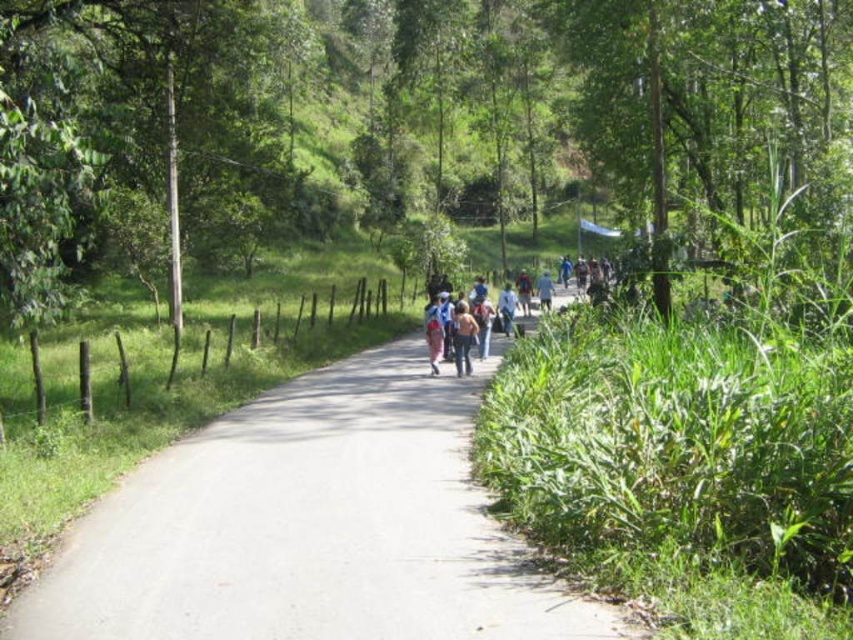
Does gray asphalt road at center have a lesser width compared to matte blue backpack at center?

In fact, gray asphalt road at center might be wider than matte blue backpack at center.

The width and height of the screenshot is (853, 640). I want to click on gray asphalt road at center, so click(x=311, y=525).

Is point (350, 592) closer to viewer compared to point (425, 330)?

Yes.

Locate an element on the screen. gray asphalt road at center is located at coordinates (311, 525).

Can you confirm if matte blue backpack at center is positioned above denim jacket at center?

Correct, matte blue backpack at center is located above denim jacket at center.

Which is in front, point (451, 342) or point (462, 374)?

Point (462, 374) is more forward.

Does point (431, 307) come closer to viewer compared to point (469, 372)?

No, it is not.

Locate an element on the screen. This screenshot has height=640, width=853. matte blue backpack at center is located at coordinates (466, 326).

Does gray asphalt road at center appear on the left side of denim jacket at center?

Yes, gray asphalt road at center is to the left of denim jacket at center.

Between gray asphalt road at center and denim jacket at center, which one appears on the right side from the viewer's perspective?

denim jacket at center

The image size is (853, 640). What do you see at coordinates (311, 525) in the screenshot? I see `gray asphalt road at center` at bounding box center [311, 525].

Where is `gray asphalt road at center`? This screenshot has width=853, height=640. gray asphalt road at center is located at coordinates (311, 525).